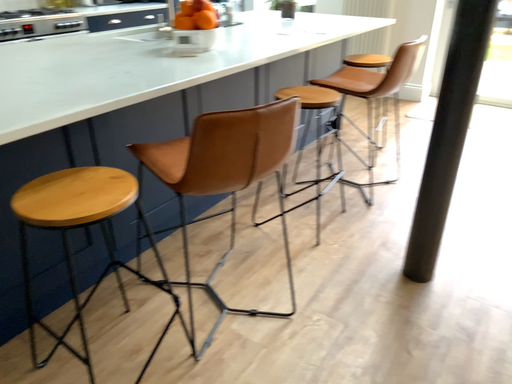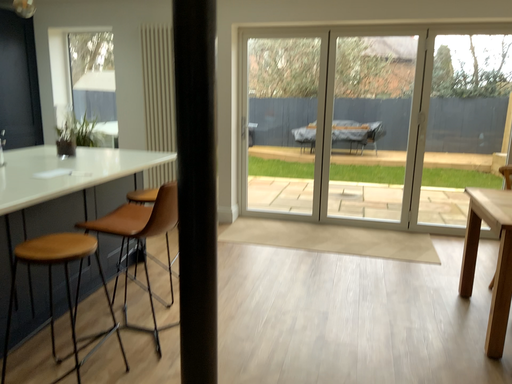
Question: Which way did the camera rotate in the video?

Choices:
 (A) rotated downward
 (B) rotated upward

Answer: (B)